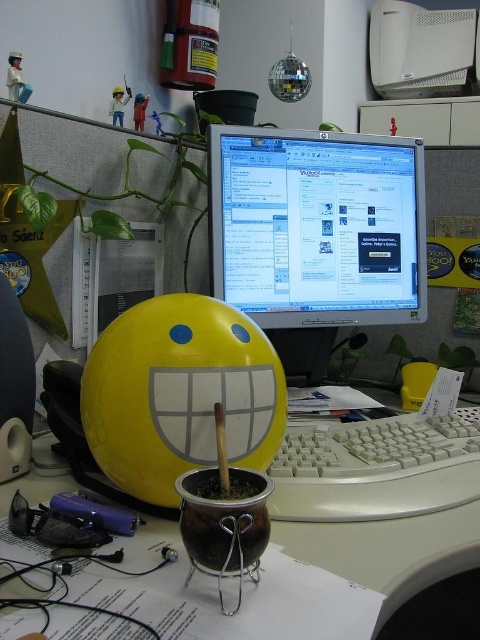
Who is lower down, brown ceramic pot at center or white plastic desktop computer at upper center?

brown ceramic pot at center is lower down.

Is brown ceramic pot at center taller than white plastic desktop computer at upper center?

In fact, brown ceramic pot at center may be shorter than white plastic desktop computer at upper center.

Which is behind, point (368, 531) or point (446, 48)?

Point (446, 48)

The height and width of the screenshot is (640, 480). I want to click on brown ceramic pot at center, so click(x=275, y=584).

What do you see at coordinates (375, 468) in the screenshot? Image resolution: width=480 pixels, height=640 pixels. I see `white plastic keyboard at center` at bounding box center [375, 468].

Who is more distant from viewer, (x=433, y=493) or (x=406, y=52)?

Positioned behind is point (x=406, y=52).

Find the location of `white plastic keyboard at center`. white plastic keyboard at center is located at coordinates (375, 468).

Who is positioned more to the left, brown ceramic pot at center or white plastic keyboard at center?

brown ceramic pot at center

Is brown ceramic pot at center positioned behind white plastic keyboard at center?

No, it is in front of white plastic keyboard at center.

The height and width of the screenshot is (640, 480). Describe the element at coordinates (275, 584) in the screenshot. I see `brown ceramic pot at center` at that location.

At what (x,y) coordinates should I click in order to perform the action: click on brown ceramic pot at center. Please return your answer as a coordinate pair (x, y). The image size is (480, 640). Looking at the image, I should click on (275, 584).